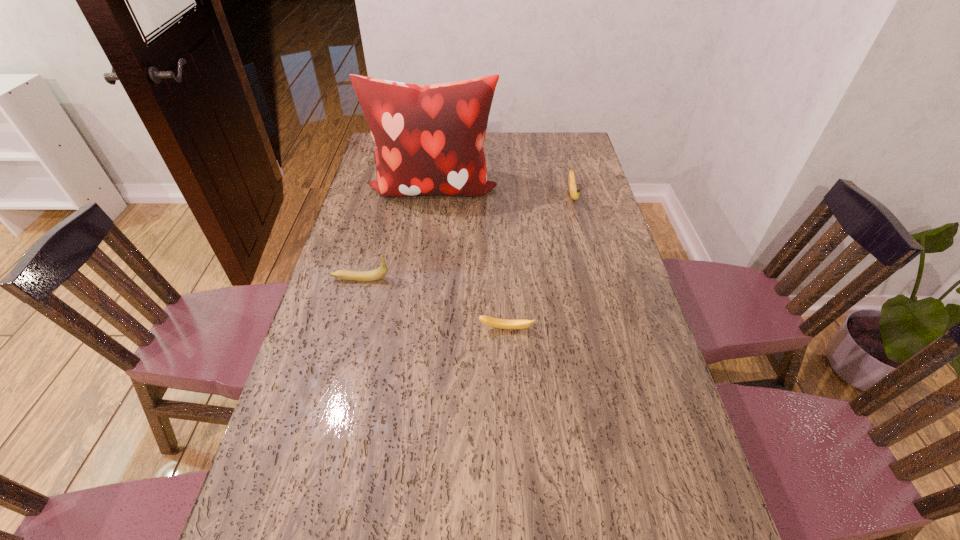
Identify the location of free space located at the stem of the nearest banana. (510, 383).

Identify the location of cushion located in the left edge section of the desktop. The width and height of the screenshot is (960, 540). (429, 139).

The image size is (960, 540). I want to click on banana located in the left edge section of the desktop, so click(x=363, y=276).

Where is `object present at the right edge`? object present at the right edge is located at coordinates (574, 192).

This screenshot has width=960, height=540. In the image, there is a desktop. What are the coordinates of `vacant space at the left edge` in the screenshot? It's located at (338, 362).

What are the coordinates of `free space at the right edge of the desktop` in the screenshot? It's located at (564, 224).

Find the location of a particular element. The image size is (960, 540). free space that is in between the rightmost banana and the second banana from right to left is located at coordinates (540, 262).

Locate an element on the screen. This screenshot has height=540, width=960. vacant area between the nearest object and the tallest object is located at coordinates [x=469, y=259].

Image resolution: width=960 pixels, height=540 pixels. Identify the location of vacant space in between the cushion and the third farthest object. (396, 234).

Identify the location of free space between the rightmost banana and the leftmost banana. coord(467,237).